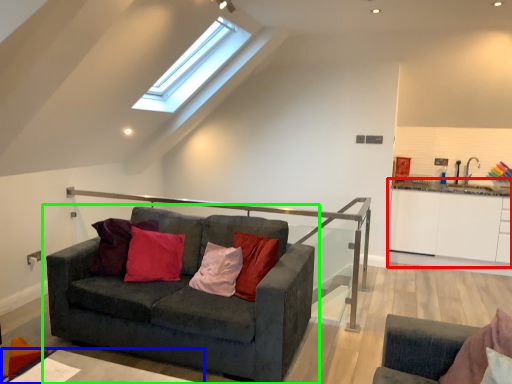
Question: Estimate the real-world distances between objects in this image. Which object is farther from cabinetry (highlighted by a red box), table (highlighted by a blue box) or studio couch (highlighted by a green box)?

Choices:
 (A) table
 (B) studio couch

Answer: (A)